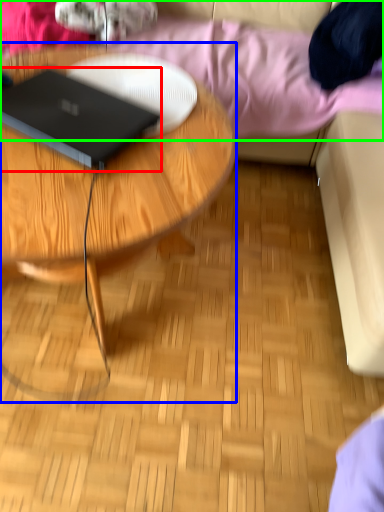
Question: Estimate the real-world distances between objects in this image. Which object is farther from laptop (highlighted by a red box), coffee table (highlighted by a blue box) or bedding (highlighted by a green box)?

Choices:
 (A) coffee table
 (B) bedding

Answer: (B)